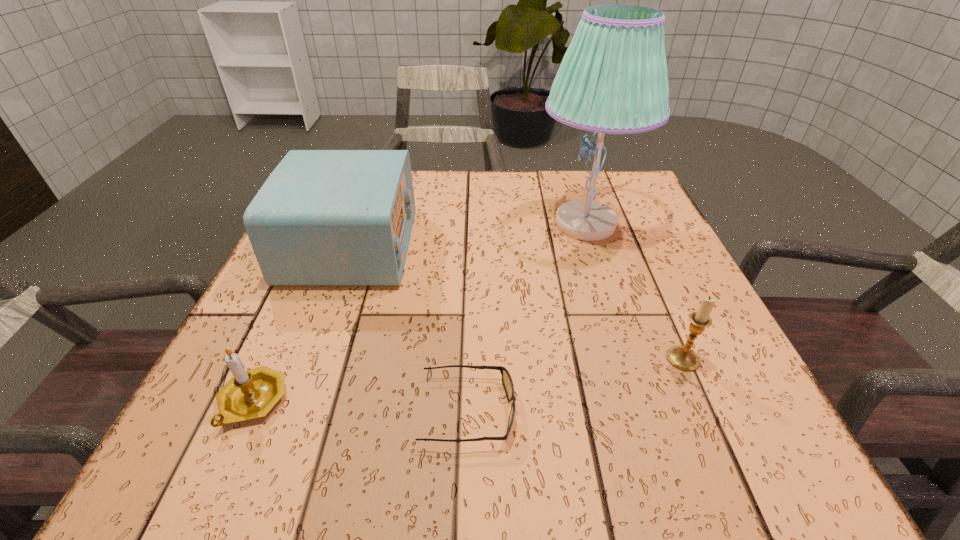
Locate an element on the screen. Image resolution: width=960 pixels, height=540 pixels. candle holder located at the right edge is located at coordinates (684, 358).

This screenshot has height=540, width=960. I want to click on object that is at the far left corner, so click(x=323, y=217).

This screenshot has height=540, width=960. I want to click on object situated at the near left corner, so click(250, 394).

At what (x,y) coordinates should I click in order to perform the action: click on object that is at the far right corner. Please return your answer as a coordinate pair (x, y). Looking at the image, I should click on (613, 79).

The width and height of the screenshot is (960, 540). I want to click on vacant space at the far edge of the desktop, so click(459, 185).

In the image, there is a desktop. Where is `vacant space at the left edge`? This screenshot has width=960, height=540. vacant space at the left edge is located at coordinates (243, 350).

Find the location of a particular element. vacant area at the right edge of the desktop is located at coordinates (657, 243).

In the image, there is a desktop. At what (x,y) coordinates should I click in order to perform the action: click on vacant space at the far right corner. Please return your answer as a coordinate pair (x, y). The image size is (960, 540). Looking at the image, I should click on (611, 192).

Find the location of a particular element. The width and height of the screenshot is (960, 540). unoccupied position between the fourth shortest object and the shorter candle holder is located at coordinates (301, 324).

This screenshot has height=540, width=960. What are the coordinates of `vacant region between the taller candle holder and the second tallest object` in the screenshot? It's located at (517, 302).